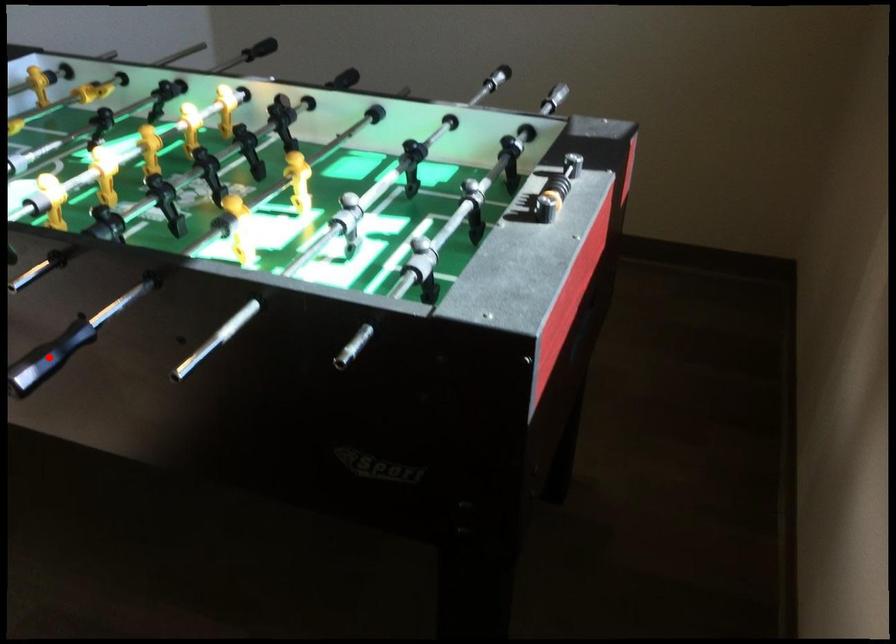
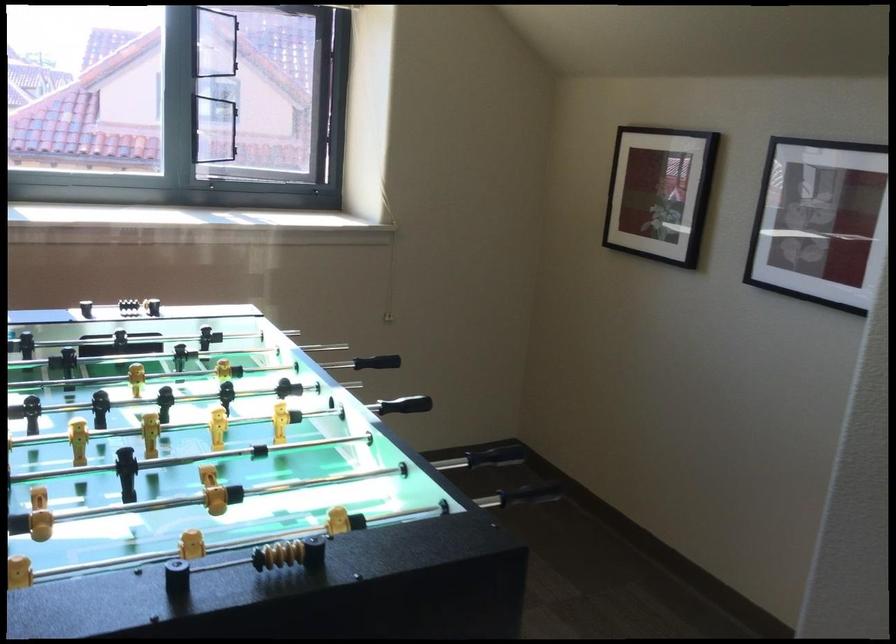
Locate, in the second image, the point that corresponds to the highlighted location in the first image.

(376, 368)